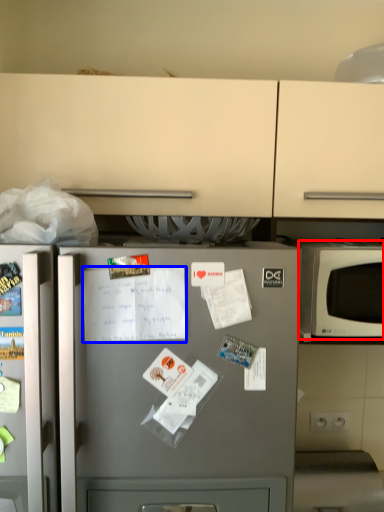
Question: Which point is closer to the camera, microwave oven (highlighted by a red box) or receipt (highlighted by a blue box)?

Choices:
 (A) microwave oven
 (B) receipt

Answer: (B)